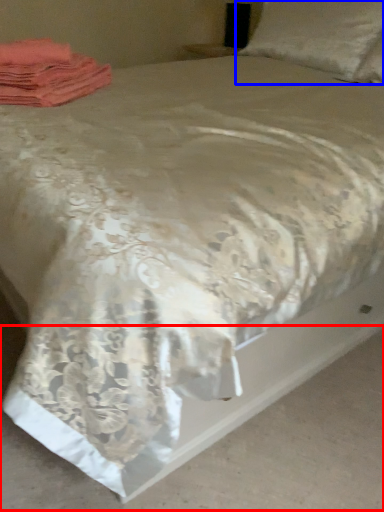
Question: Which of the following is the closest to the observer, concrete (highlighted by a red box) or pillow (highlighted by a blue box)?

Choices:
 (A) concrete
 (B) pillow

Answer: (A)